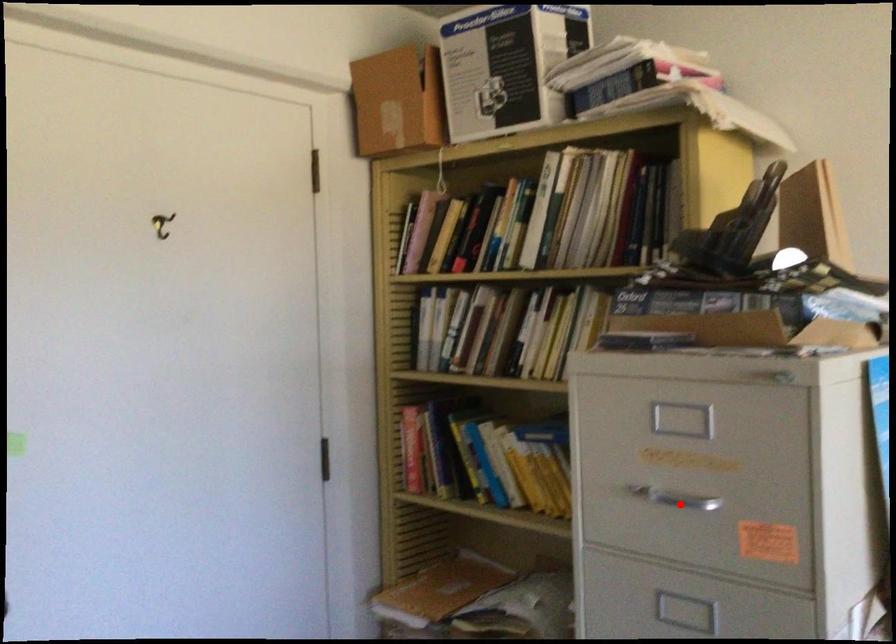
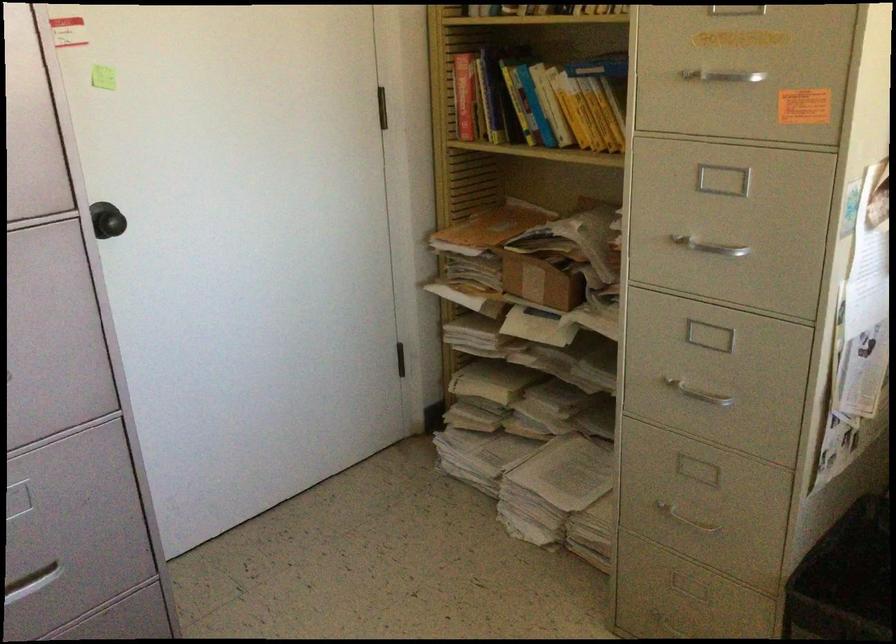
Question: I am providing you with two images of the same scene from different viewpoints. Given a red point in image1, look at the same physical point in image2. Is it:

Choices:
 (A) Closer to the viewpoint
 (B) Farther from the viewpoint

Answer: (B)